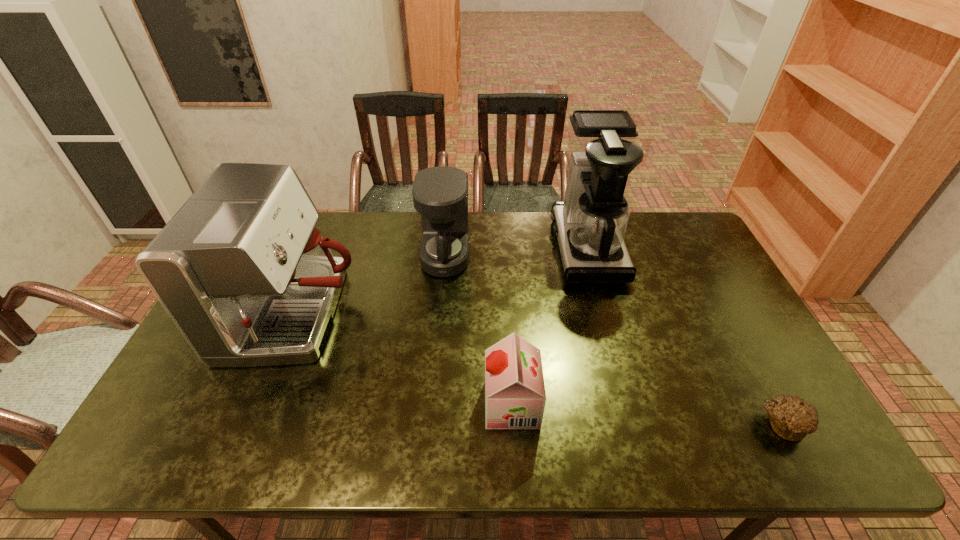
Locate an element on the screen. The height and width of the screenshot is (540, 960). object that is at the right edge is located at coordinates (792, 418).

Where is `object positioned at the near right corner`? Image resolution: width=960 pixels, height=540 pixels. object positioned at the near right corner is located at coordinates (792, 418).

At what (x,y) coordinates should I click in order to perform the action: click on free region at the far edge of the desktop. Please return your answer as a coordinate pair (x, y). The image size is (960, 540). Looking at the image, I should click on (333, 226).

In the image, there is a desktop. Where is `free space at the near edge`? The height and width of the screenshot is (540, 960). free space at the near edge is located at coordinates (573, 435).

The height and width of the screenshot is (540, 960). Find the location of `vacant space at the left edge of the desktop`. vacant space at the left edge of the desktop is located at coordinates (179, 412).

You are a GUI agent. You are given a task and a screenshot of the screen. Output one action in this format:
    pyautogui.click(x=<x>, y=<y>)
    Task: Click on the free location at the right edge
    This screenshot has height=540, width=960.
    Given the screenshot: What is the action you would take?
    pyautogui.click(x=708, y=297)

In the image, there is a desktop. Identify the location of free space at the far right corner. Image resolution: width=960 pixels, height=540 pixels. [669, 231].

The width and height of the screenshot is (960, 540). I want to click on free space between the shortest object and the soya milk, so pos(647,414).

Locate an element on the screen. vacant space in between the shortest coffee maker and the leftmost object is located at coordinates (372, 286).

Locate an element on the screen. The height and width of the screenshot is (540, 960). free area in between the shortest coffee maker and the third object from right to left is located at coordinates (479, 330).